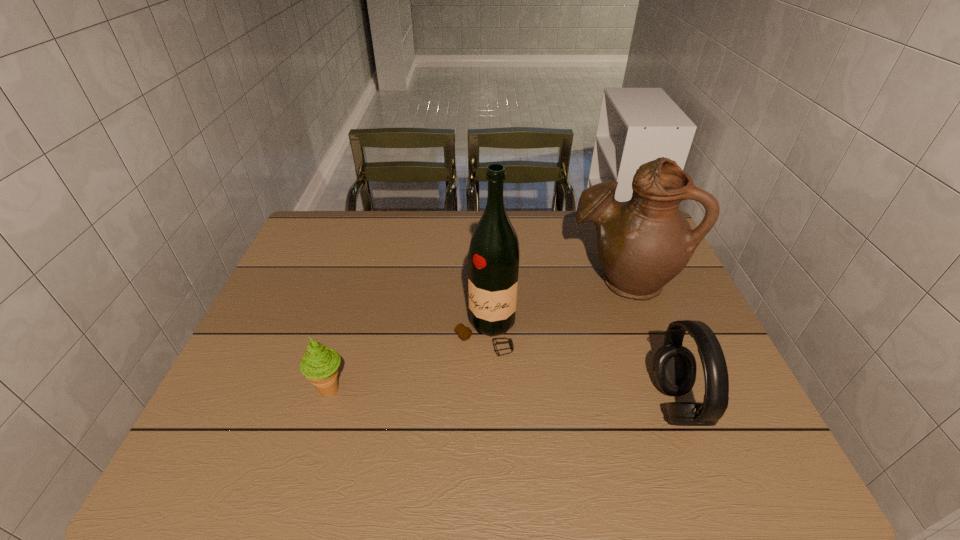
Locate an element on the screen. The width and height of the screenshot is (960, 540). free space that satisfies the following two spatial constraints: 1. on the front side of the shortest object; 2. on the earcups of the headset is located at coordinates (326, 404).